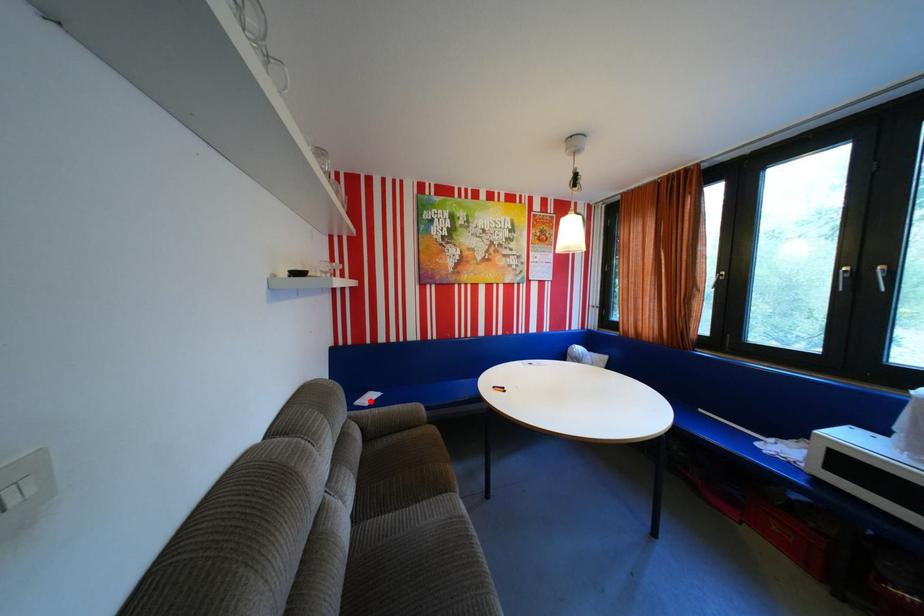
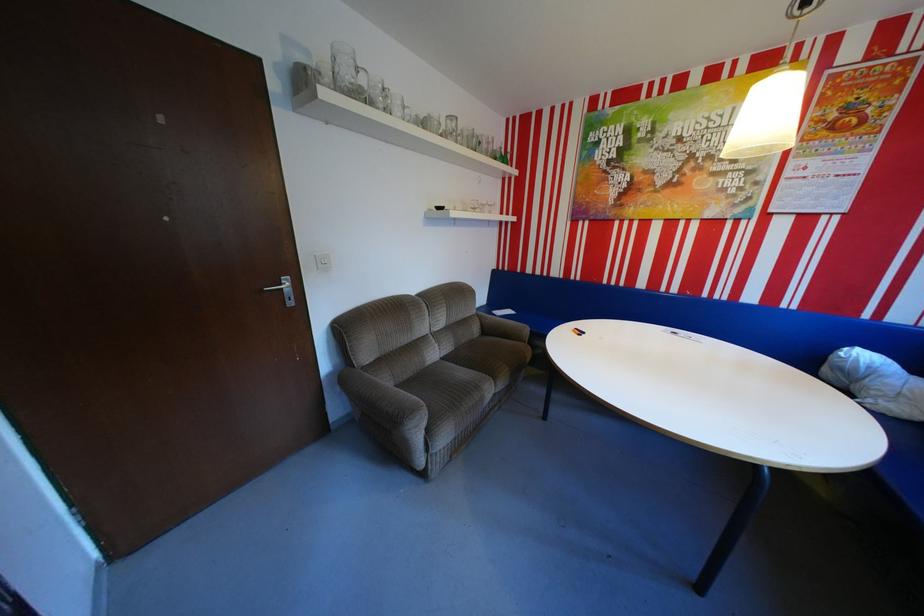
In the second image, find the point that corresponds to the highlighted location in the first image.

(506, 310)